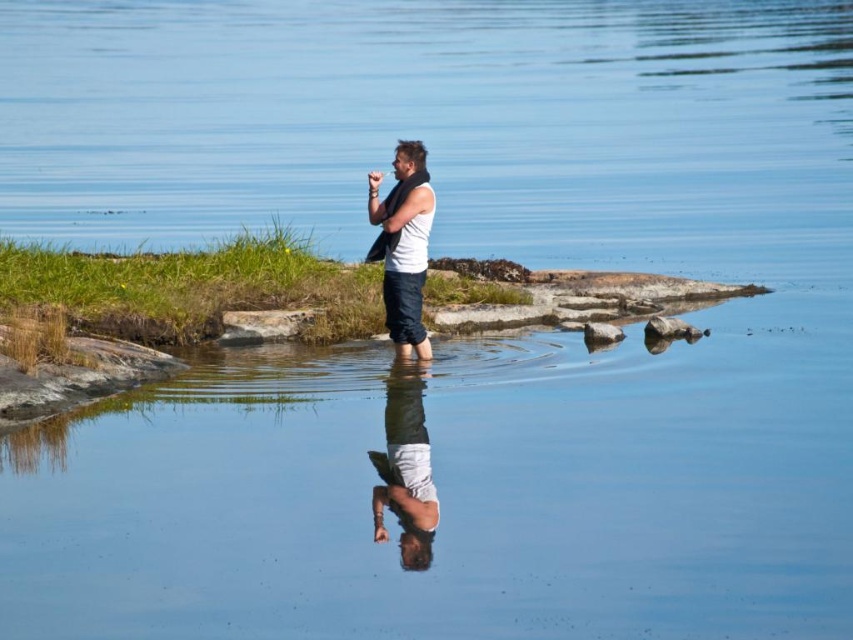
Which of these two, white matte shirt at center or smooth gray rock at center, stands taller?

With more height is smooth gray rock at center.

Between white matte shirt at center and smooth gray rock at center, which one appears on the left side from the viewer's perspective?

white matte shirt at center is more to the left.

Between point (383, 456) and point (596, 321), which one is positioned behind?

Positioned behind is point (596, 321).

Image resolution: width=853 pixels, height=640 pixels. I want to click on white matte shirt at center, so click(x=405, y=472).

Does white matte tank top at center appear on the right side of smooth gray rock at center?

In fact, white matte tank top at center is to the left of smooth gray rock at center.

Measure the distance between white matte tank top at center and smooth gray rock at center.

A distance of 2.39 meters exists between white matte tank top at center and smooth gray rock at center.

Who is more forward, (397,294) or (602,326)?

Point (397,294) is in front.

Find the location of `white matte tank top at center`. white matte tank top at center is located at coordinates (403, 244).

Does white matte tank top at center have a smaller size compared to white matte shirt at center?

No.

Can you confirm if white matte tank top at center is taller than white matte shirt at center?

Indeed, white matte tank top at center has a greater height compared to white matte shirt at center.

This screenshot has width=853, height=640. I want to click on white matte tank top at center, so click(x=403, y=244).